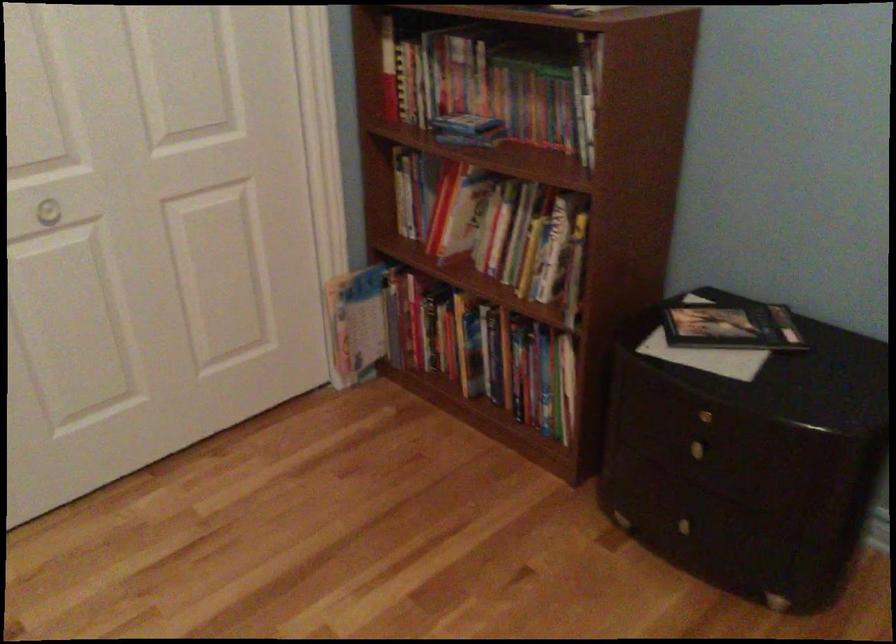
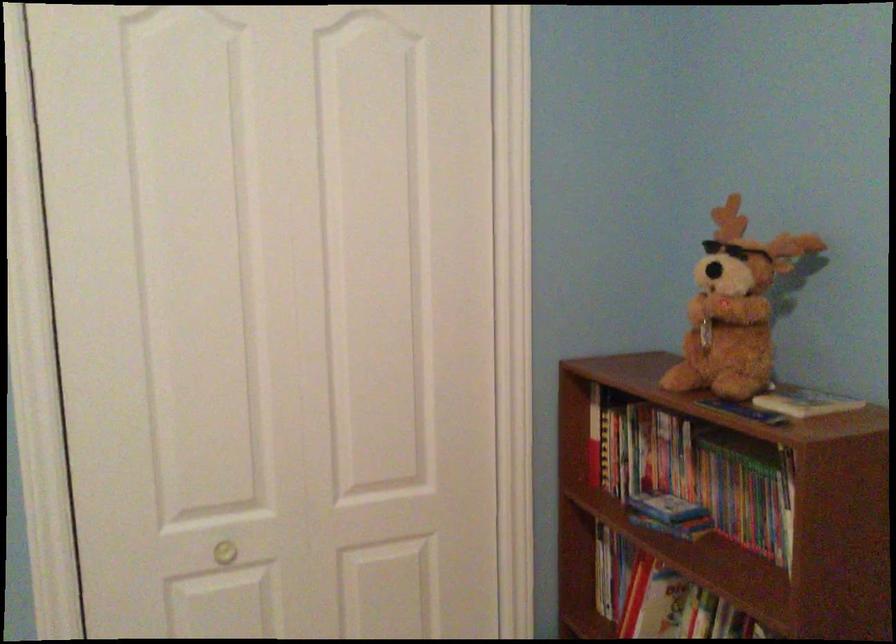
The images are taken continuously from a first-person perspective. In which direction is your viewpoint rotating?

The camera rotated toward left-up.